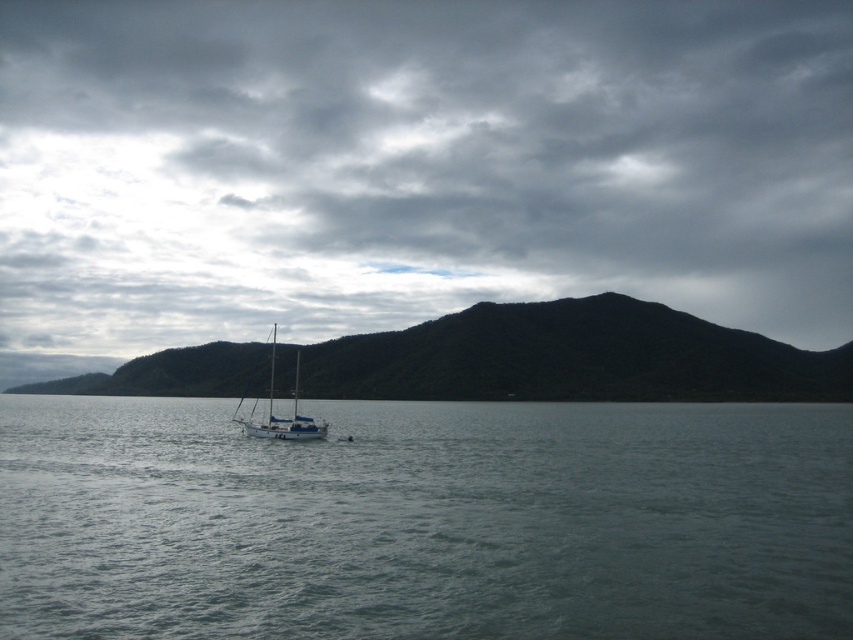
Does clear water at center have a larger size compared to green matte mountain at center?

No.

Which is behind, point (248, 576) or point (62, 392)?

Point (62, 392)

Between point (309, 486) and point (524, 352), which one is positioned behind?

The point (524, 352) is behind.

The width and height of the screenshot is (853, 640). Find the location of `clear water at center`. clear water at center is located at coordinates (425, 520).

Can you confirm if dark gray cloudy sky at upper center is thinner than white matte sailboat at center?

In fact, dark gray cloudy sky at upper center might be wider than white matte sailboat at center.

Who is taller, dark gray cloudy sky at upper center or white matte sailboat at center?

dark gray cloudy sky at upper center is taller.

Locate an element on the screen. The width and height of the screenshot is (853, 640). dark gray cloudy sky at upper center is located at coordinates (413, 168).

Is dark gray cloudy sky at upper center positioned at the back of green matte mountain at center?

Yes, it is.

Between point (332, 326) and point (165, 365), which one is positioned in front?

Positioned in front is point (165, 365).

What are the coordinates of `dark gray cloudy sky at upper center` in the screenshot? It's located at (413, 168).